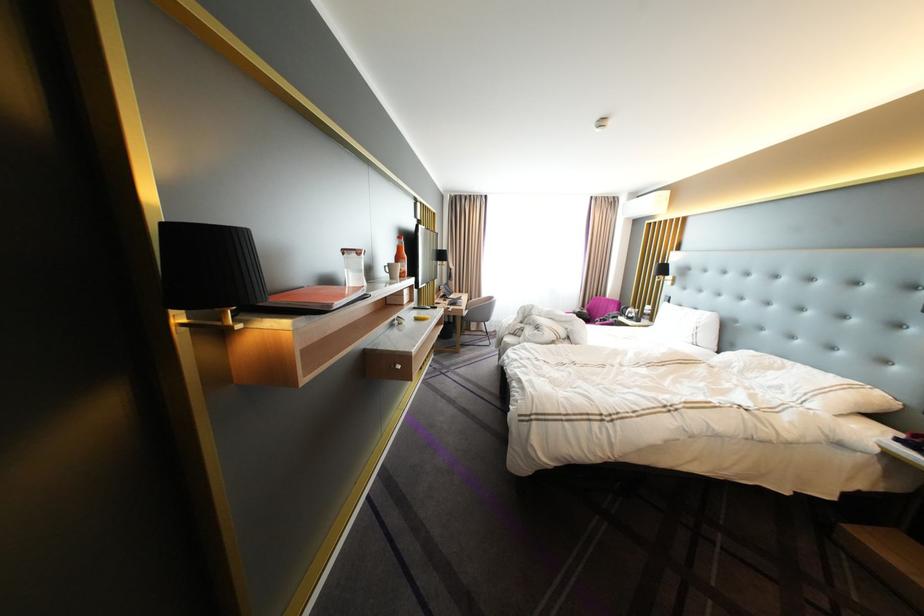
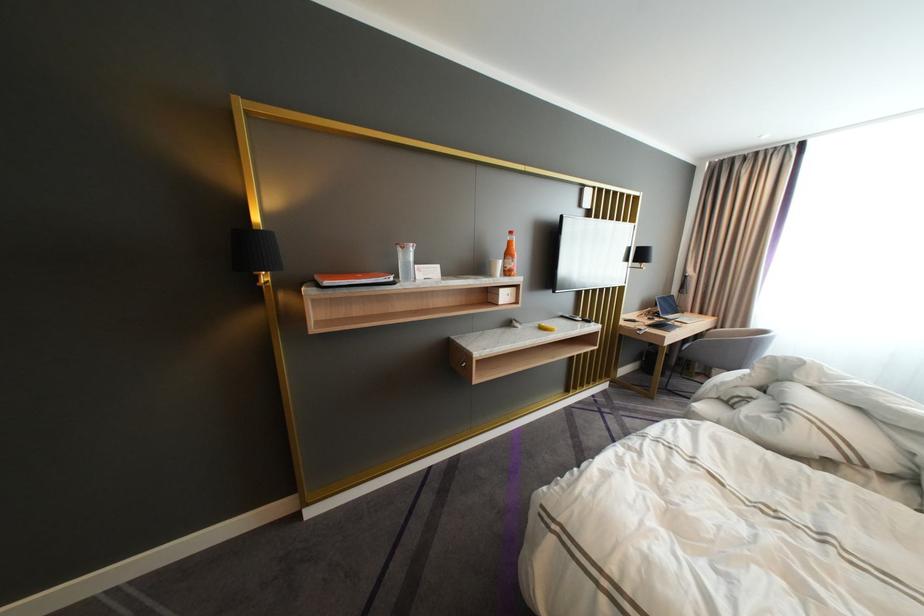
The point at (429, 307) is marked in the first image. Where is the corresponding point in the second image?

(578, 315)